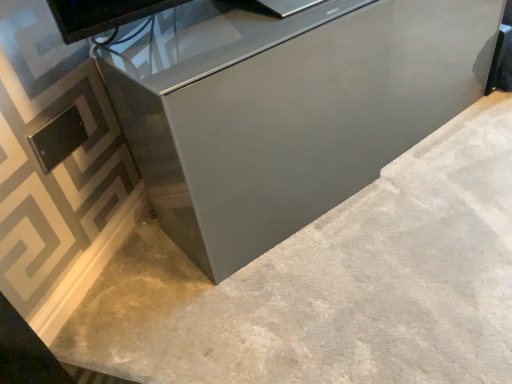
Image resolution: width=512 pixels, height=384 pixels. What are the coordinates of `satin gray cabinet at center` in the screenshot? It's located at (285, 108).

What do you see at coordinates (285, 108) in the screenshot? The width and height of the screenshot is (512, 384). I see `satin gray cabinet at center` at bounding box center [285, 108].

This screenshot has height=384, width=512. What do you see at coordinates (332, 284) in the screenshot? I see `gray polished concrete at center` at bounding box center [332, 284].

Where is `gray polished concrete at center`? This screenshot has width=512, height=384. gray polished concrete at center is located at coordinates (332, 284).

Identify the location of satin gray cabinet at center. (285, 108).

Which is more to the right, satin gray cabinet at center or gray polished concrete at center?

Positioned to the right is satin gray cabinet at center.

Which object is closer to the camera taking this photo, satin gray cabinet at center or gray polished concrete at center?

Positioned in front is gray polished concrete at center.

Which is further, (420, 38) or (465, 150)?

The point (465, 150) is more distant.

From the image's perspective, would you say satin gray cabinet at center is positioned over gray polished concrete at center?

Yes, from the image's perspective, satin gray cabinet at center is on top of gray polished concrete at center.

From a real-world perspective, who is located higher, satin gray cabinet at center or gray polished concrete at center?

satin gray cabinet at center.

Does satin gray cabinet at center have a greater width compared to gray polished concrete at center?

Incorrect, the width of satin gray cabinet at center does not surpass that of gray polished concrete at center.

Does satin gray cabinet at center have a lesser height compared to gray polished concrete at center?

No, satin gray cabinet at center is not shorter than gray polished concrete at center.

Is satin gray cabinet at center bigger than gray polished concrete at center?

Yes.

Is gray polished concrete at center inside satin gray cabinet at center?

No, gray polished concrete at center is not surrounded by satin gray cabinet at center.

Is satin gray cabinet at center not near gray polished concrete at center?

satin gray cabinet at center is near gray polished concrete at center, not far away.

Could you tell me if satin gray cabinet at center is turned towards gray polished concrete at center?

No, satin gray cabinet at center is not aimed at gray polished concrete at center.

Find the location of a particular element. The image size is (512, 384). concrete lying in front of the satin gray cabinet at center is located at coordinates (332, 284).

Considering the positions of objects gray polished concrete at center and satin gray cabinet at center in the image provided, who is more to the right, gray polished concrete at center or satin gray cabinet at center?

satin gray cabinet at center is more to the right.

In the image, is gray polished concrete at center positioned in front of or behind satin gray cabinet at center?

Visually, gray polished concrete at center is located in front of satin gray cabinet at center.

Considering the positions of points (231, 326) and (222, 169), is point (231, 326) closer to camera compared to point (222, 169)?

No, (231, 326) is further to viewer.

From the image's perspective, is gray polished concrete at center over satin gray cabinet at center?

No, from the image's perspective, gray polished concrete at center is not on top of satin gray cabinet at center.

From a real-world perspective, between gray polished concrete at center and satin gray cabinet at center, who is vertically higher?

From a 3D spatial view, satin gray cabinet at center is above.

Does gray polished concrete at center have a greater width compared to satin gray cabinet at center?

Yes.

Considering the relative sizes of gray polished concrete at center and satin gray cabinet at center in the image provided, is gray polished concrete at center shorter than satin gray cabinet at center?

Yes, gray polished concrete at center is shorter than satin gray cabinet at center.

Which of these two, gray polished concrete at center or satin gray cabinet at center, is bigger?

With larger size is satin gray cabinet at center.

Can satin gray cabinet at center be found inside gray polished concrete at center?

No.

Would you say gray polished concrete at center is a long distance from satin gray cabinet at center?

No, gray polished concrete at center is not far from satin gray cabinet at center.

Is gray polished concrete at center looking in the opposite direction of satin gray cabinet at center?

No, gray polished concrete at center is not facing the opposite direction of satin gray cabinet at center.

Locate an element on the screen. furniture positioned vertically above the gray polished concrete at center (from a real-world perspective) is located at coordinates (285, 108).

In order to click on concrete that appears below the satin gray cabinet at center (from a real-world perspective) in this screenshot , I will do `click(332, 284)`.

Where is `concrete located on the left of satin gray cabinet at center`? concrete located on the left of satin gray cabinet at center is located at coordinates (332, 284).